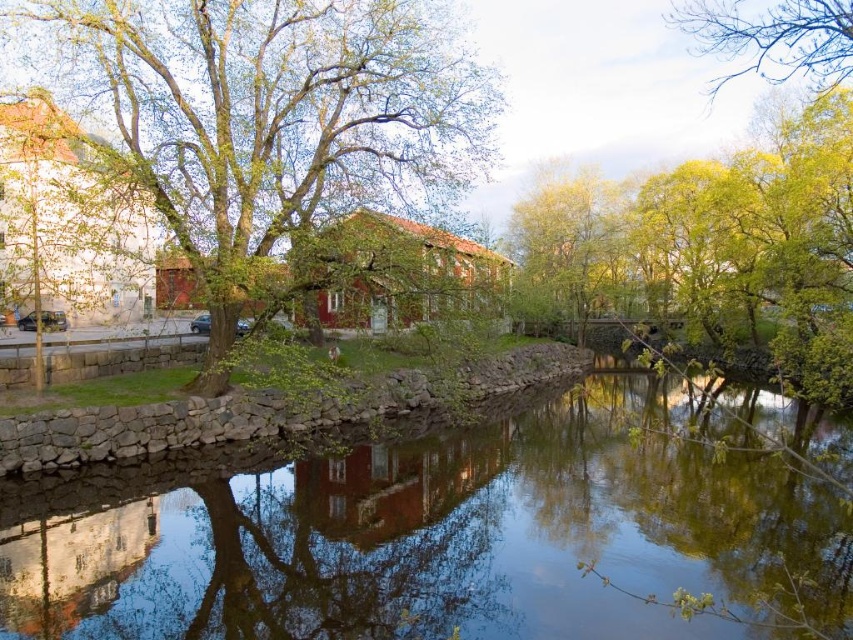
You are standing on the stone embankment and want to take a photo of the clear water at center and the green leafy tree at upper right. Which object should you focus on first if you want both to be in sharp focus?

You should focus on the green leafy tree at upper right first because it is farther away than the clear water at center, ensuring both will be in focus when using depth of field.